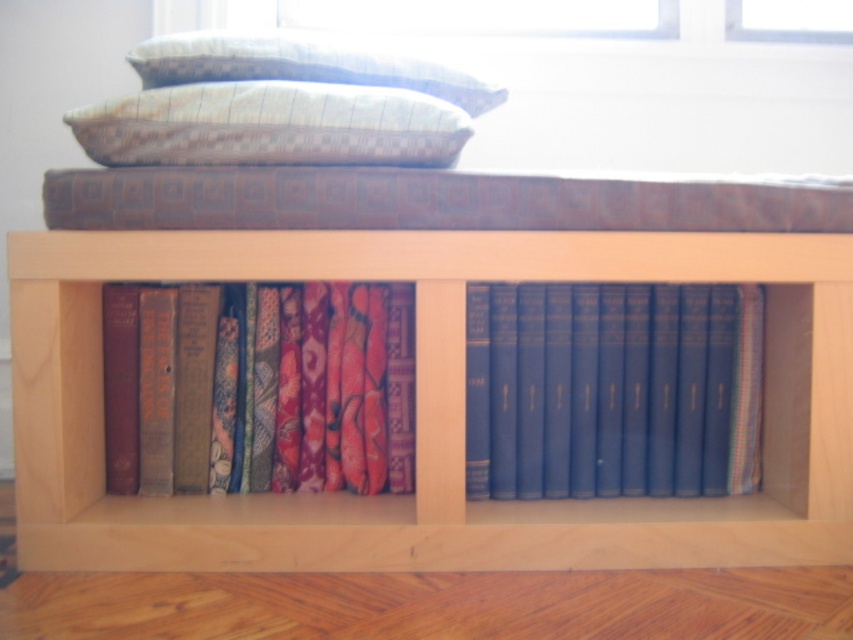
Consider the image. Which is below, wooden bookcase at center or blue hardcover books at center?

blue hardcover books at center is below.

Can you confirm if wooden bookcase at center is positioned above blue hardcover books at center?

Yes, wooden bookcase at center is above blue hardcover books at center.

Who is more forward, (370, 545) or (468, 298)?

Point (370, 545) is in front.

Locate an element on the screen. wooden bookcase at center is located at coordinates (424, 364).

Is blue hardcover books at center to the right of checkered fabric pillow at upper center from the viewer's perspective?

Correct, you'll find blue hardcover books at center to the right of checkered fabric pillow at upper center.

Can you confirm if blue hardcover books at center is positioned to the left of checkered fabric pillow at upper center?

In fact, blue hardcover books at center is to the right of checkered fabric pillow at upper center.

This screenshot has width=853, height=640. Find the location of `blue hardcover books at center`. blue hardcover books at center is located at coordinates (612, 390).

Is blue hardcover books at center further to the viewer compared to patterned fabric pillow at upper center?

No, it is in front of patterned fabric pillow at upper center.

Is blue hardcover books at center bigger than patterned fabric pillow at upper center?

No.

Is point (735, 301) closer to viewer compared to point (363, 61)?

Yes.

Locate an element on the screen. This screenshot has width=853, height=640. blue hardcover books at center is located at coordinates (612, 390).